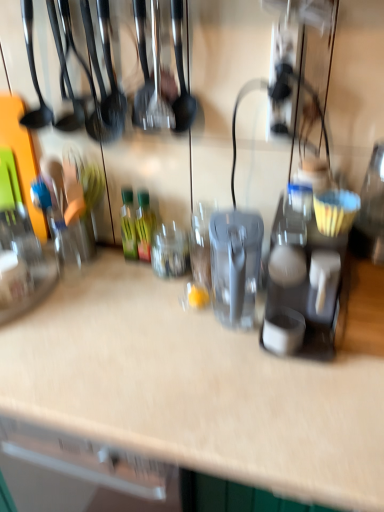
Question: Is green glass bottle at center, which ranks as the first bottle in right-to-left order, inside the boundaries of green glass bottle at center, the 2th bottle when ordered from right to left, or outside?

Choices:
 (A) outside
 (B) inside

Answer: (A)

Question: In terms of height, does green glass bottle at center, the 2th bottle viewed from the left, look taller or shorter compared to green glass bottle at center, the 2th bottle when ordered from right to left?

Choices:
 (A) short
 (B) tall

Answer: (A)

Question: Which is nearer to the green glass bottle at center, which ranks as the first bottle in right-to-left order?

Choices:
 (A) matte gray coffee maker at center right
 (B) green glass bottle at center, positioned as the first bottle in left-to-right order

Answer: (B)

Question: Which object is positioned farthest from the green glass bottle at center, positioned as the first bottle in left-to-right order?

Choices:
 (A) green glass bottle at center, which ranks as the first bottle in right-to-left order
 (B) matte gray coffee maker at center right

Answer: (B)